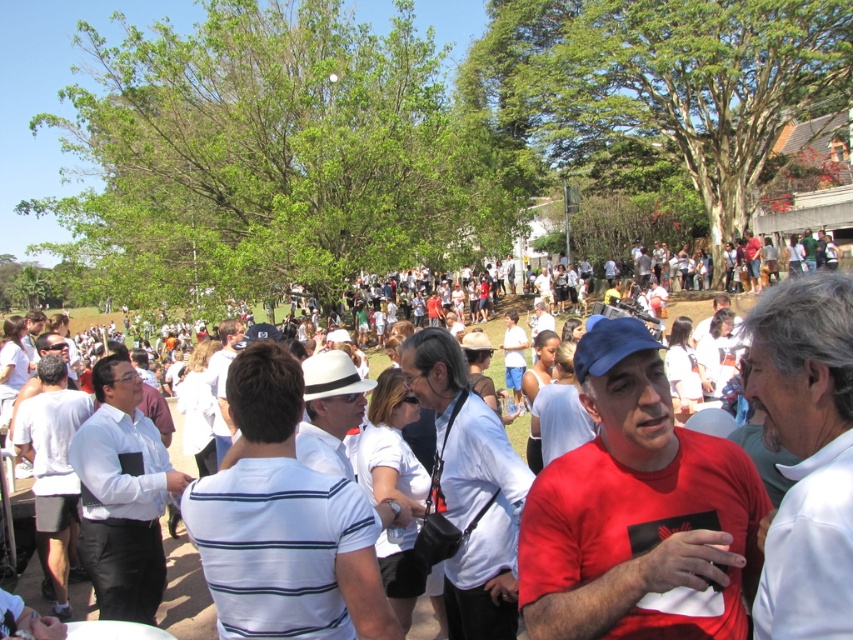
Question: Which of the following is the closest to the observer?

Choices:
 (A) (523, 488)
 (B) (788, 442)

Answer: (B)

Question: Among these points, which one is nearest to the camera?

Choices:
 (A) (366, 596)
 (B) (764, 413)
 (C) (512, 598)

Answer: (A)

Question: Is matte red t-shirt at center above white striped shirt at center?

Choices:
 (A) no
 (B) yes

Answer: (B)

Question: Which point is farther to the camera?

Choices:
 (A) white matte shirt at center
 (B) white cotton shirt at left
 (C) matte red t-shirt at center

Answer: (B)

Question: Does white striped shirt at center appear under white cotton shirt at left?

Choices:
 (A) no
 (B) yes

Answer: (A)

Question: Does white smooth shirt at center appear on the left side of white matte shirt at center?

Choices:
 (A) yes
 (B) no

Answer: (B)